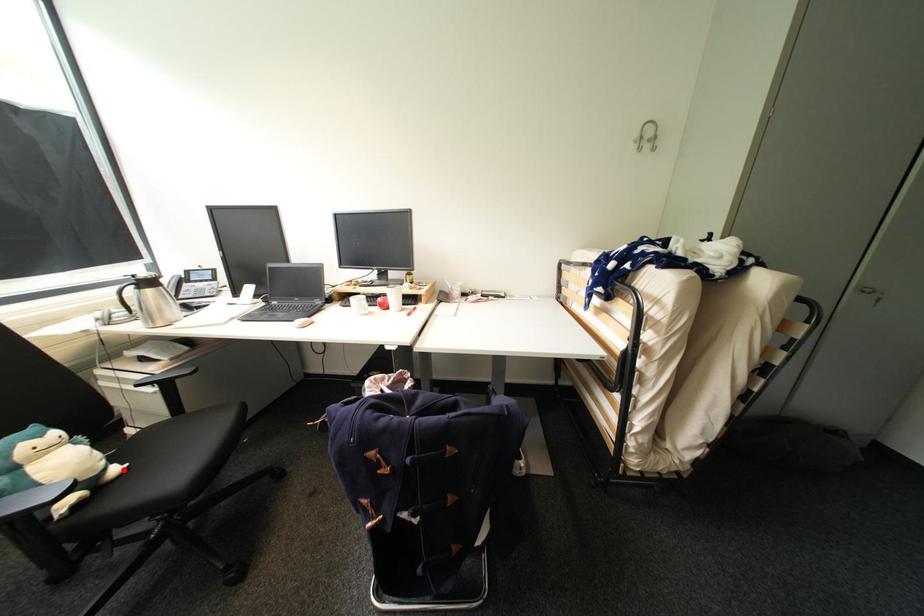
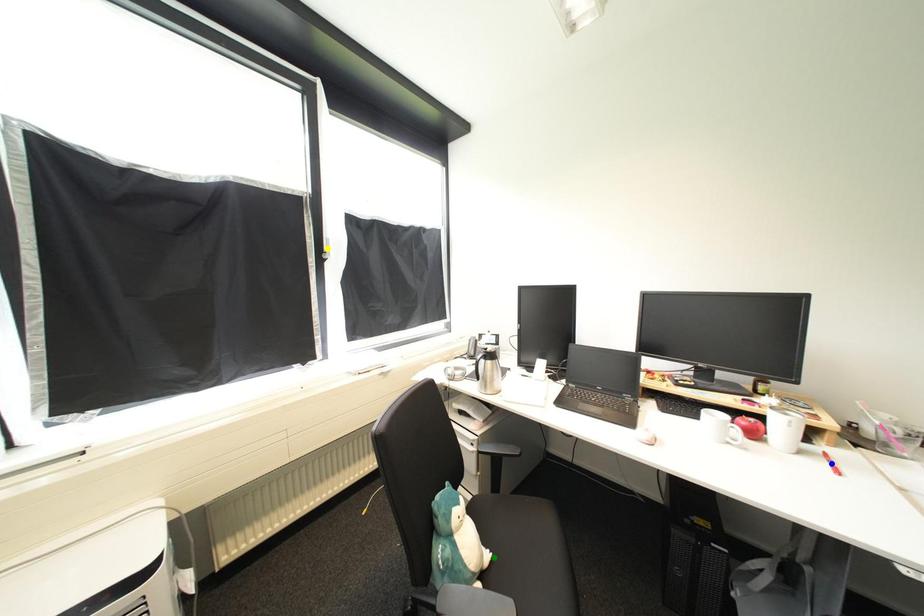
Question: I am providing you with two images of the same scene from different viewpoints. A red point is marked on the first image. You are given multiple points on the second image. Which spot in image 2 lines up with the point in image 1?

Choices:
 (A) green point
 (B) blue point
 (C) yellow point

Answer: (A)